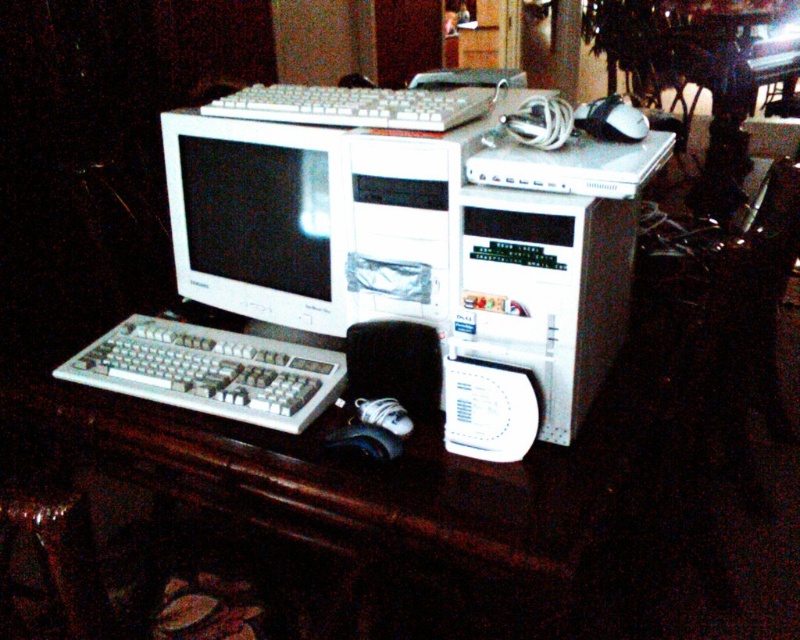
You are setting up a new desk and want to place both the white plastic computer tower at center and the white glossy monitor at center. Given their sizes, which object should you place first to ensure there is enough space for both?

The white plastic computer tower at center has a smaller size compared to the white glossy monitor at center, so you should place the white glossy monitor at center first to accommodate its larger size, ensuring there is enough space left for the smaller tower.

You are setting up a new computer workstation and need to place the white plastic keyboard at lower left and the black rubber mouse at lower center. According to the image, where should you position the mouse relative to the keyboard?

The white plastic keyboard at lower left is to the left of the black rubber mouse at lower center, so the mouse should be placed to the right of the keyboard.